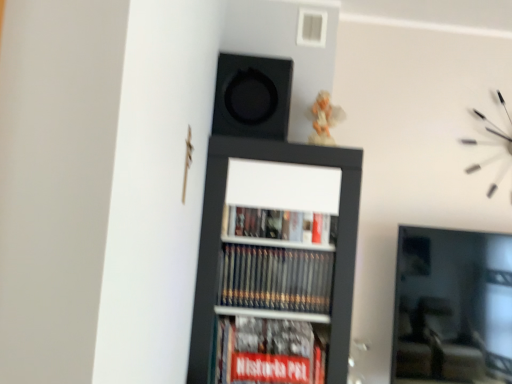
Question: Is white matte clock at upper right next to black matte speaker at upper center?

Choices:
 (A) yes
 (B) no

Answer: (B)

Question: Can black matte speaker at upper center be found inside white matte clock at upper right?

Choices:
 (A) no
 (B) yes

Answer: (A)

Question: Is white matte clock at upper right bigger than black matte speaker at upper center?

Choices:
 (A) no
 (B) yes

Answer: (A)

Question: Is white matte clock at upper right shorter than black matte speaker at upper center?

Choices:
 (A) no
 (B) yes

Answer: (A)

Question: Is white matte clock at upper right far from black matte speaker at upper center?

Choices:
 (A) no
 (B) yes

Answer: (B)

Question: In terms of height, does black matte bookcase at center look taller or shorter compared to black matte speaker at upper center?

Choices:
 (A) tall
 (B) short

Answer: (A)

Question: From the image's perspective, is black matte bookcase at center located above or below black matte speaker at upper center?

Choices:
 (A) above
 (B) below

Answer: (B)

Question: Does point (276, 235) appear closer or farther from the camera than point (281, 64)?

Choices:
 (A) farther
 (B) closer

Answer: (B)

Question: In the image, is black matte bookcase at center on the left side or the right side of black matte speaker at upper center?

Choices:
 (A) right
 (B) left

Answer: (A)

Question: From the image's perspective, is black matte speaker at upper center positioned above or below black matte bookcase at center?

Choices:
 (A) below
 (B) above

Answer: (B)

Question: In terms of width, does black matte speaker at upper center look wider or thinner when compared to black matte bookcase at center?

Choices:
 (A) wide
 (B) thin

Answer: (B)

Question: Choose the correct answer: Is black matte speaker at upper center inside black matte bookcase at center or outside it?

Choices:
 (A) outside
 (B) inside

Answer: (A)

Question: From a real-world perspective, is black matte speaker at upper center above or below black matte bookcase at center?

Choices:
 (A) above
 (B) below

Answer: (A)

Question: Is white matte clock at upper right to the left or to the right of black matte speaker at upper center in the image?

Choices:
 (A) left
 (B) right

Answer: (B)

Question: Is white matte clock at upper right situated inside black matte speaker at upper center or outside?

Choices:
 (A) inside
 (B) outside

Answer: (B)